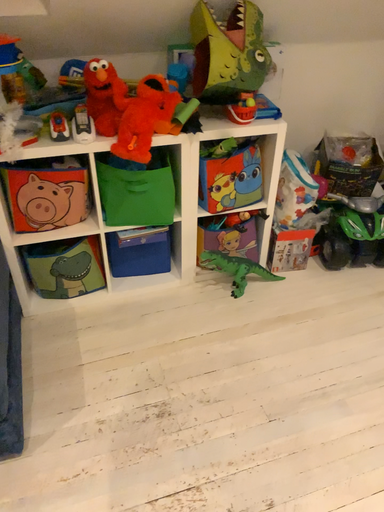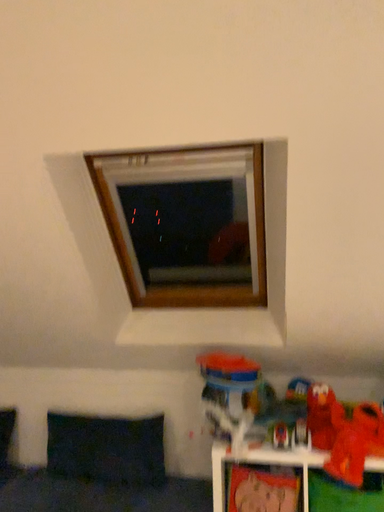
Question: Which way did the camera rotate in the video?

Choices:
 (A) rotated right
 (B) rotated left

Answer: (B)